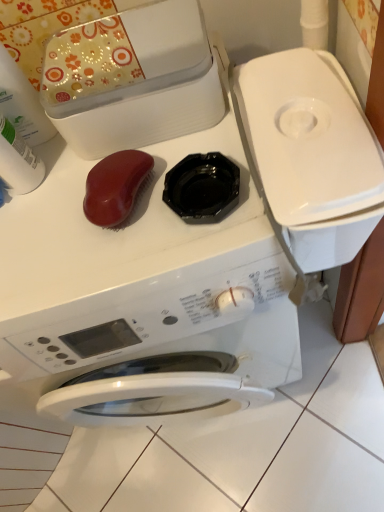
Question: Considering their positions, is white plastic bottle at upper left, which is the 1th cleaning product from top to bottom, located in front of or behind white plastic bottle at left, placed as the 1th cleaning product when sorted from bottom to top?

Choices:
 (A) behind
 (B) front

Answer: (B)

Question: Would you say white plastic bottle at upper left, which is the 1th cleaning product from top to bottom, is to the left or to the right of white plastic bottle at left, marked as the 2th cleaning product in a top-to-bottom arrangement, in the picture?

Choices:
 (A) left
 (B) right

Answer: (A)

Question: Which of these objects is positioned farthest from the white plastic bottle at upper left, which ranks as the second cleaning product in bottom-to-top order?

Choices:
 (A) white glossy washing machine at center
 (B) white plastic bottle at left, marked as the 2th cleaning product in a top-to-bottom arrangement

Answer: (A)

Question: Estimate the real-world distances between objects in this image. Which object is farther from the white plastic bottle at left, placed as the 1th cleaning product when sorted from bottom to top?

Choices:
 (A) white glossy washing machine at center
 (B) white plastic bottle at upper left, which ranks as the second cleaning product in bottom-to-top order

Answer: (A)